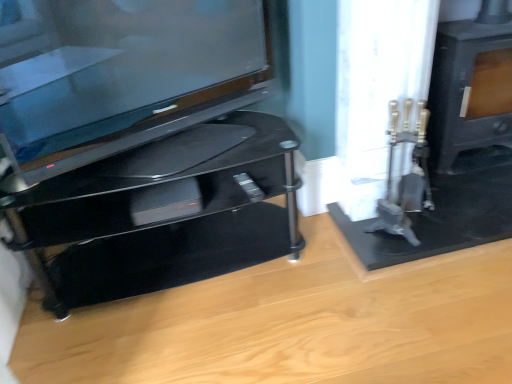
Question: Would you consider glossy black tv at left to be distant from black glossy tv stand at left?

Choices:
 (A) yes
 (B) no

Answer: (B)

Question: Is black glossy tv stand at left located within glossy black tv at left?

Choices:
 (A) yes
 (B) no

Answer: (B)

Question: Considering the relative sizes of glossy black tv at left and black glossy tv stand at left in the image provided, is glossy black tv at left wider than black glossy tv stand at left?

Choices:
 (A) yes
 (B) no

Answer: (B)

Question: Considering the relative positions of glossy black tv at left and black glossy tv stand at left in the image provided, is glossy black tv at left behind black glossy tv stand at left?

Choices:
 (A) no
 (B) yes

Answer: (A)

Question: Is glossy black tv at left in contact with black glossy tv stand at left?

Choices:
 (A) no
 (B) yes

Answer: (A)

Question: Does glossy black tv at left appear on the right side of black glossy tv stand at left?

Choices:
 (A) no
 (B) yes

Answer: (B)

Question: Is black glossy tv stand at left at the back of matte black stove at right?

Choices:
 (A) yes
 (B) no

Answer: (B)

Question: Are matte black stove at right and black glossy tv stand at left far apart?

Choices:
 (A) no
 (B) yes

Answer: (B)

Question: Can you confirm if matte black stove at right is bigger than black glossy tv stand at left?

Choices:
 (A) yes
 (B) no

Answer: (B)

Question: Can you confirm if matte black stove at right is thinner than black glossy tv stand at left?

Choices:
 (A) yes
 (B) no

Answer: (A)

Question: Is the position of matte black stove at right less distant than that of black glossy tv stand at left?

Choices:
 (A) yes
 (B) no

Answer: (B)

Question: Does matte black stove at right appear on the right side of black glossy tv stand at left?

Choices:
 (A) no
 (B) yes

Answer: (B)

Question: From a real-world perspective, is black glossy tv stand at left over glossy black tv at left?

Choices:
 (A) yes
 (B) no

Answer: (B)